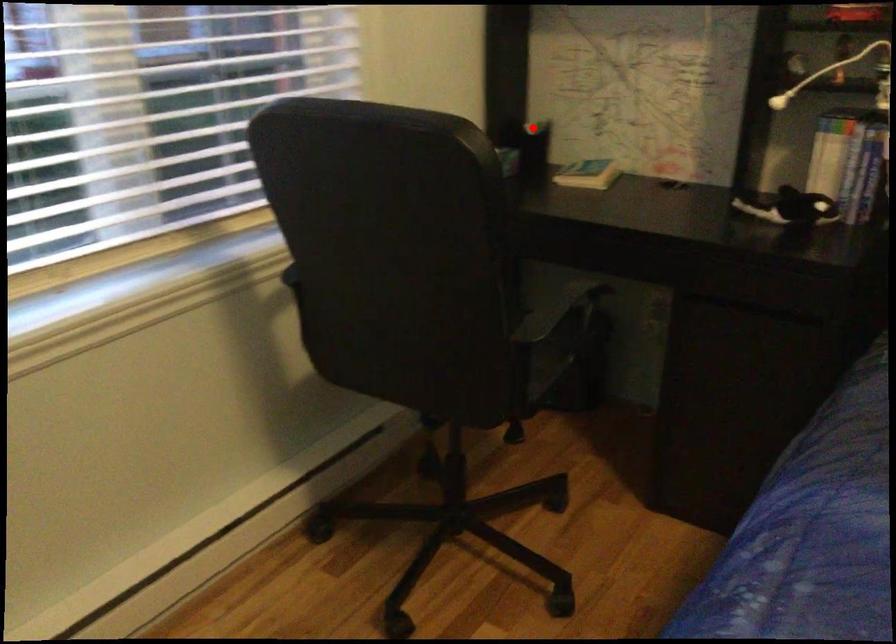
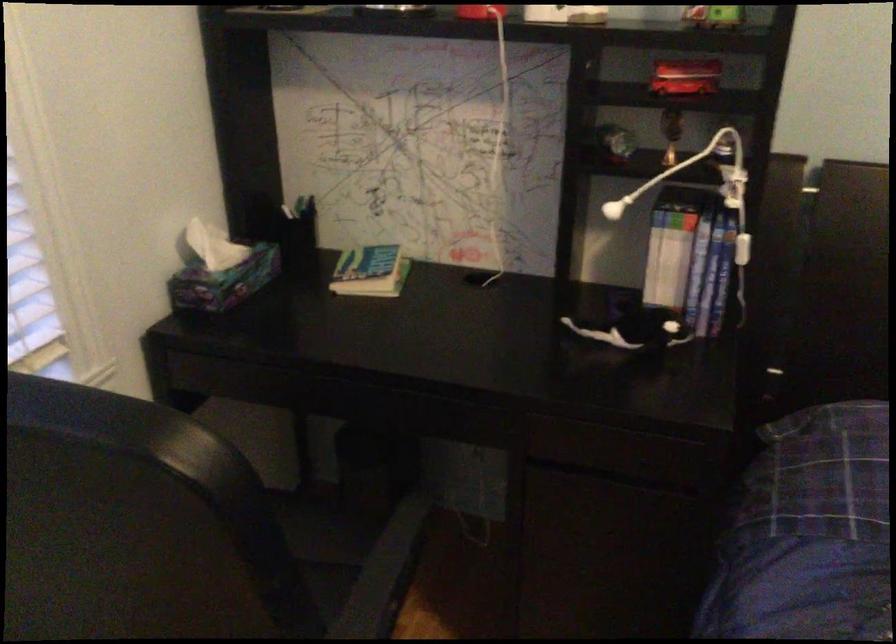
Find the pixel in the second image that matches the highlighted location in the first image.

(295, 211)